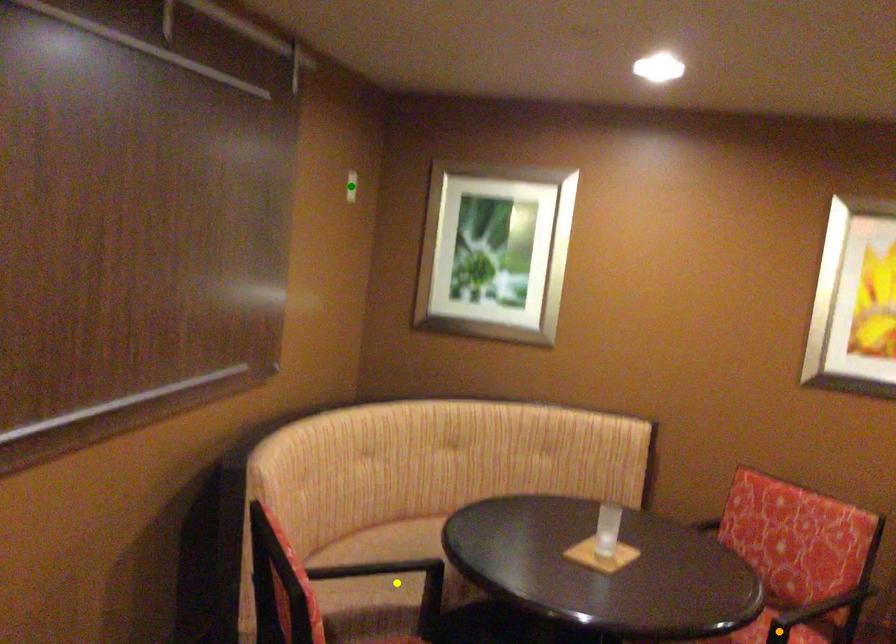
Order these from nearest to farthest:
A) green point
B) yellow point
C) orange point

1. yellow point
2. orange point
3. green point